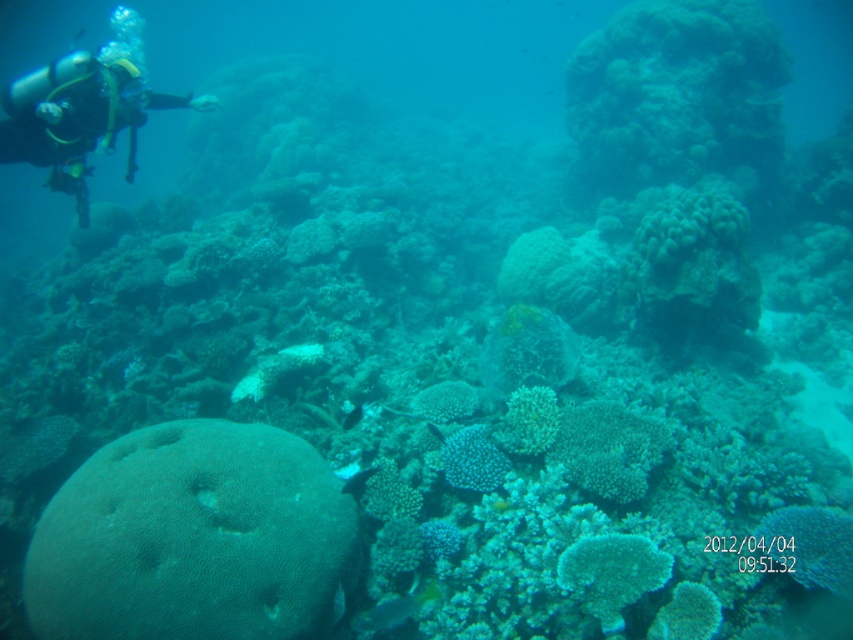
Based on the photo, you are a marine biologist studying the coral reef. You notice the matte black scuba diver at upper left and the spotted coral at center. Which object is taller in the image?

The matte black scuba diver at upper left is taller than the spotted coral at center.

You are a marine biologist studying coral locations in the reef. You notice the smooth brown coral at center. Can you determine its exact coordinates in the image?

The smooth brown coral at center is located at point [193,538].